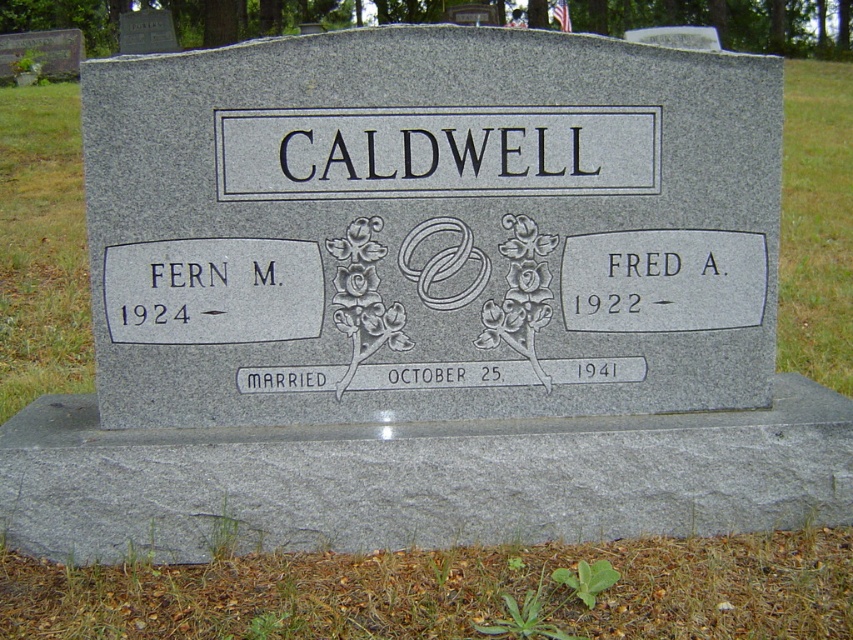
Question: Which of the following is the farthest from the observer?

Choices:
 (A) (582, 115)
 (B) (556, 577)

Answer: (A)

Question: Which point is closer to the camera?

Choices:
 (A) (538, 164)
 (B) (602, 566)

Answer: (B)

Question: Can you confirm if black granite sign at center is bigger than green leafy weed at lower center?

Choices:
 (A) no
 (B) yes

Answer: (B)

Question: Does black granite sign at center appear on the right side of green leafy weed at lower center?

Choices:
 (A) no
 (B) yes

Answer: (A)

Question: Which point is farther to the camera?

Choices:
 (A) green leafy weed at lower center
 (B) black granite sign at center

Answer: (B)

Question: Is black granite sign at center wider than green leafy weed at lower center?

Choices:
 (A) no
 (B) yes

Answer: (B)